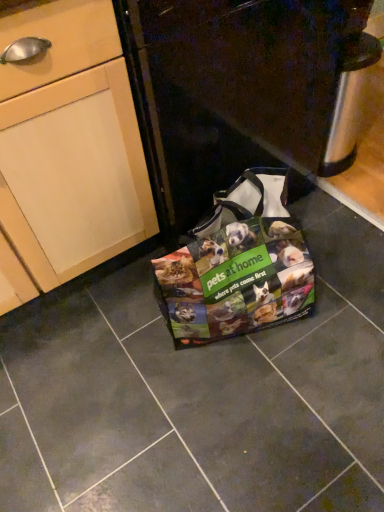
This screenshot has width=384, height=512. What are the coordinates of `black glossy refrigerator at center` in the screenshot? It's located at (242, 90).

What do you see at coordinates (242, 90) in the screenshot? I see `black glossy refrigerator at center` at bounding box center [242, 90].

The image size is (384, 512). What are the coordinates of `black glossy refrigerator at center` in the screenshot? It's located at [242, 90].